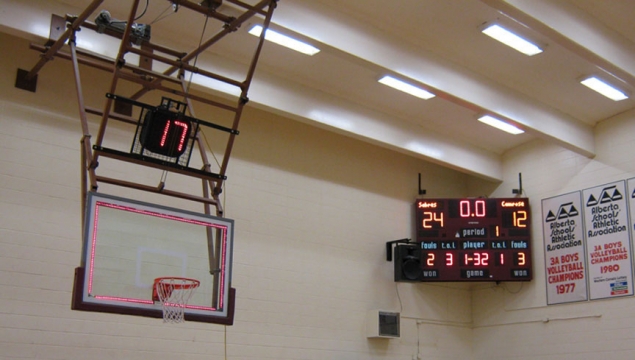
Locate an element on the screen. Image resolution: width=635 pixels, height=360 pixels. speaker is located at coordinates (385, 321).